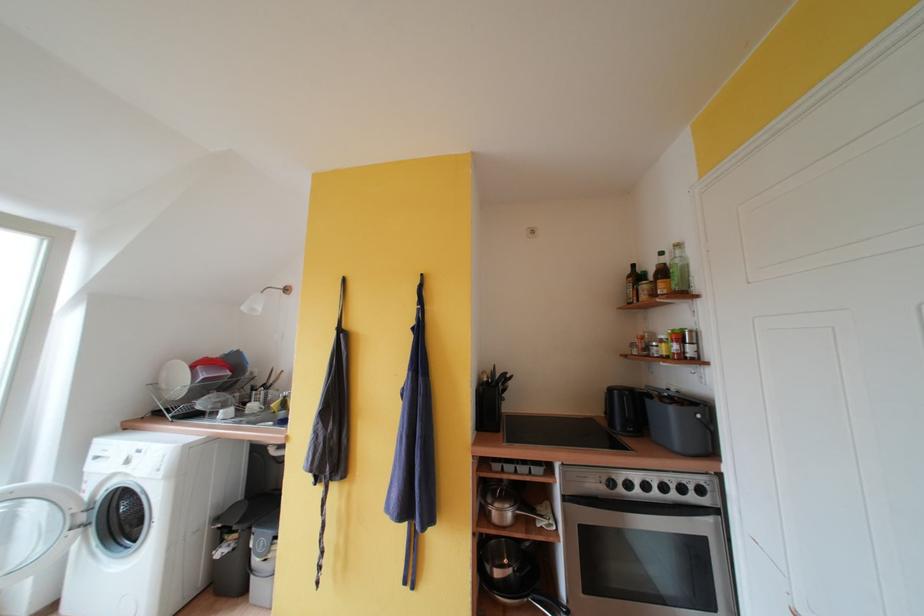
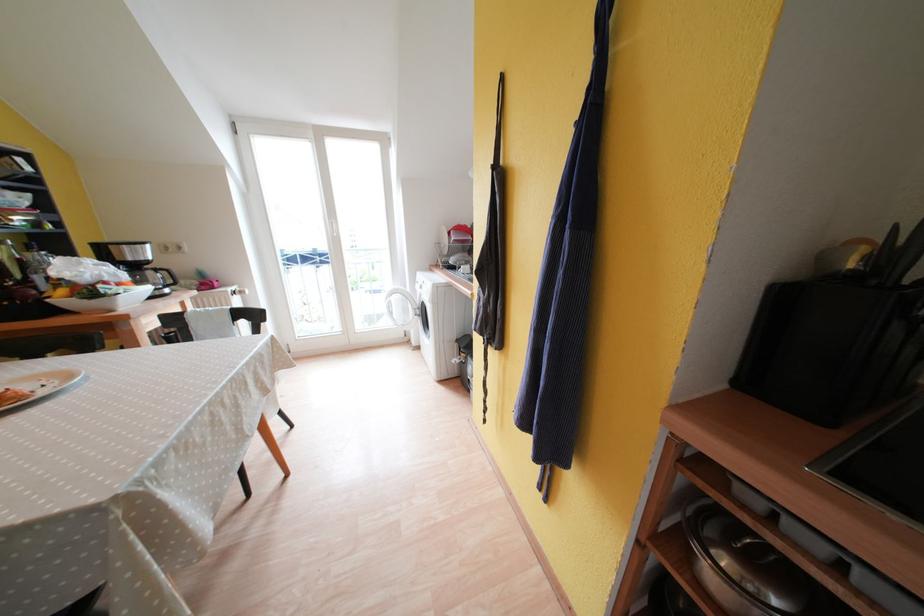
First-person continuous shooting, in which direction is the camera rotating?

The rotation direction of the camera is left-down.